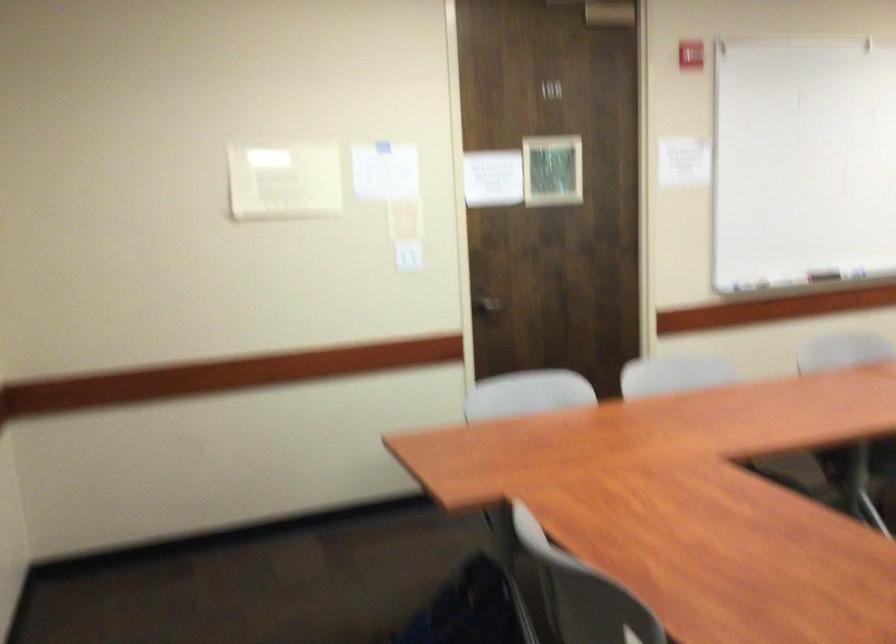
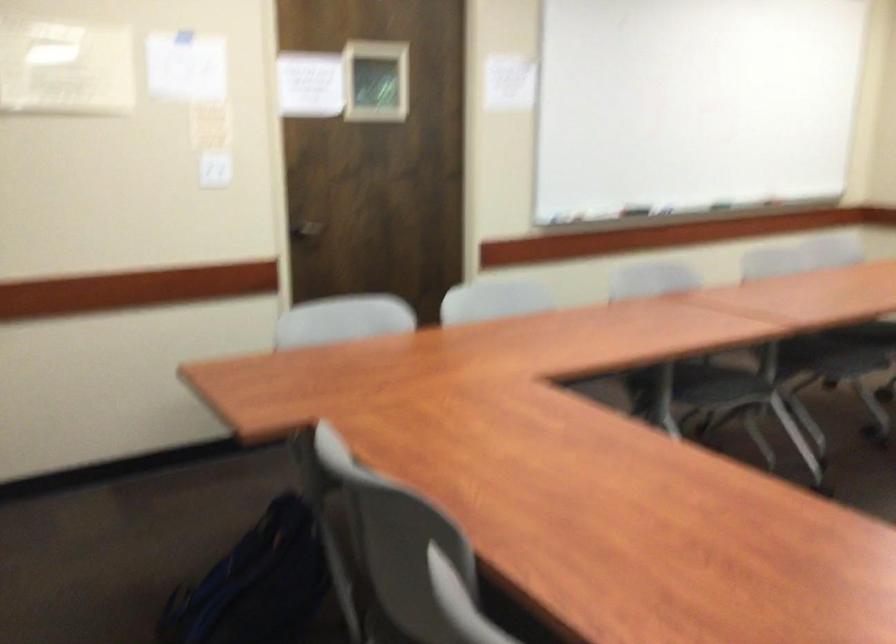
The images are taken continuously from a first-person perspective. In which direction are you moving?

The movement direction of the cameraman is right, forward.